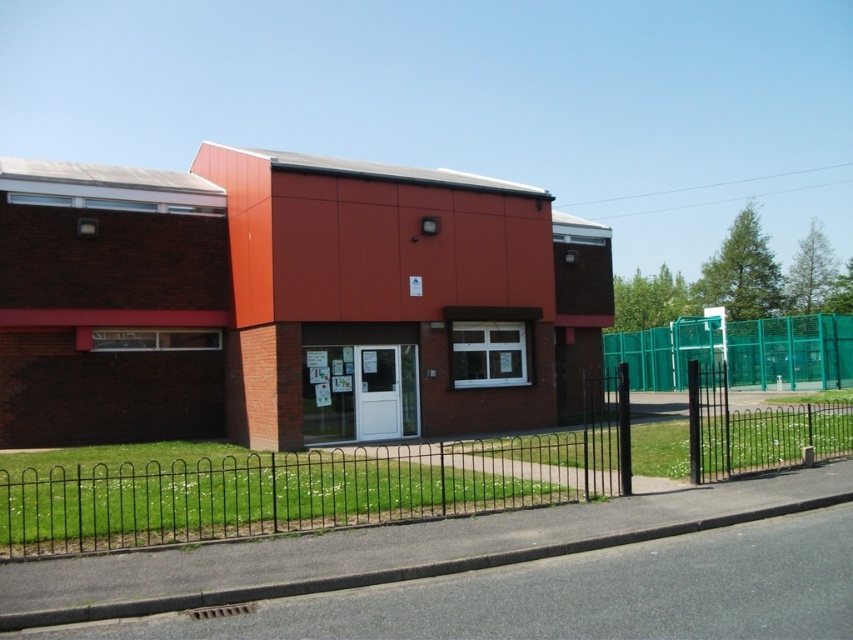
You are a delivery person trying to determine the best path to the entrance of the two story building. You see the black wrought iron fence at center and the green mesh fence at center. Which fence is closer to the road?

The black wrought iron fence at center is closer to the road because it is located below the green mesh fence at center, indicating it is positioned lower and nearer to the street level.

You are standing on the sidewalk across the street from the two story building. You want to walk to the entrance of the building. Which direction should you walk relative to the black wrought iron fence at center?

The black wrought iron fence at center is located at point (312,486), which means it is positioned to the right side of the image. Since you are on the sidewalk across the street, you should walk towards the left to reach the entrance of the building, moving away from the black wrought iron fence at center.